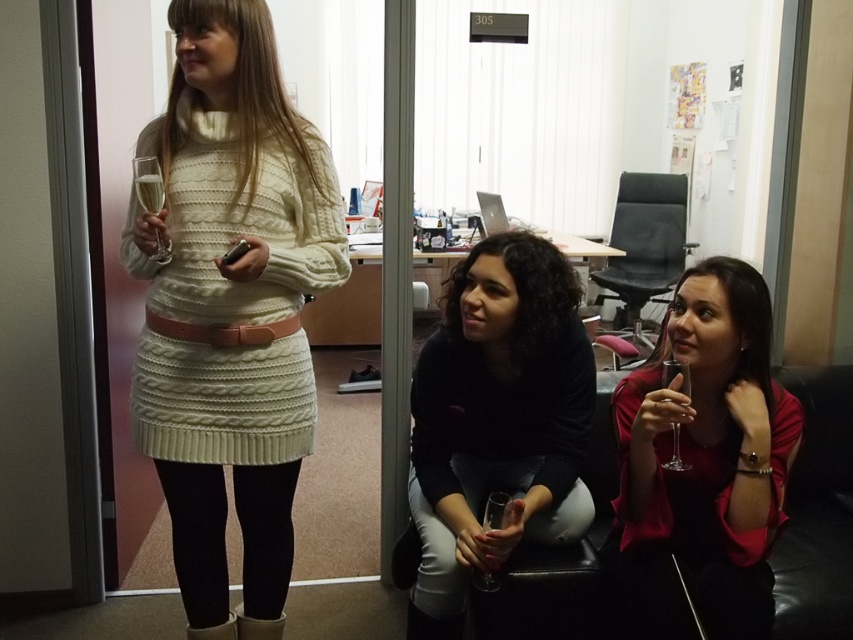
You are organizing a photoshoot and need to place two dresses in the scene. The white knitted dress at center and the matte red dress at lower right must be positioned such that they don not overlap. Given their widths, which dress should be placed closer to the edge to ensure there is enough space?

The white knitted dress at center is wider than the matte red dress at lower right. To prevent overlapping, the wider white knitted dress at center should be placed closer to the center, while the narrower matte red dress at lower right can be positioned near the edge.

You are organizing a photoshoot and need to ensure that the models in the white knitted dress at center and the matte red dress at lower right are visible in the frame. Based on their positions, which dress is closer to the camera?

The white knitted dress at center is positioned over the matte red dress at lower right, so it is closer to the camera.

You are organizing a photoshoot and need to ensure proper spacing between the white knitted dress at center and the black matte shirt at center. According to the scene, what is the minimum distance you should maintain between them to ensure they are positioned as shown?

The minimum distance you should maintain between the white knitted dress at center and the black matte shirt at center is 19.64 inches to ensure they are positioned as shown.